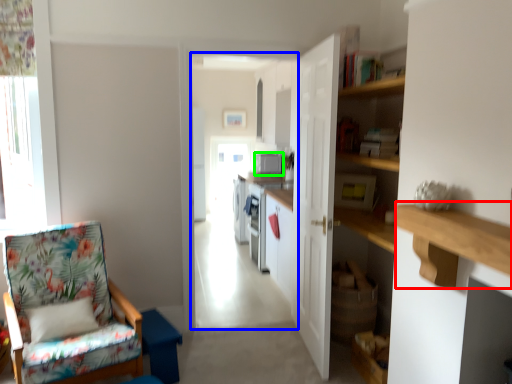
Question: Which object is the farthest from ledge (highlighted by a red box)? Choose among these: corridor (highlighted by a blue box) or appliance (highlighted by a green box).

Choices:
 (A) corridor
 (B) appliance

Answer: (A)